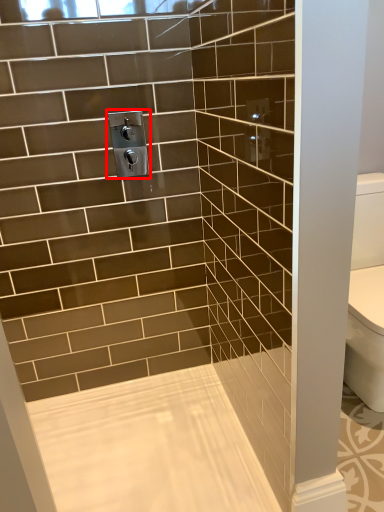
Question: From the image's perspective, where is plumbing fixture (annotated by the red box) located in relation to bath in the image?

Choices:
 (A) below
 (B) above

Answer: (B)